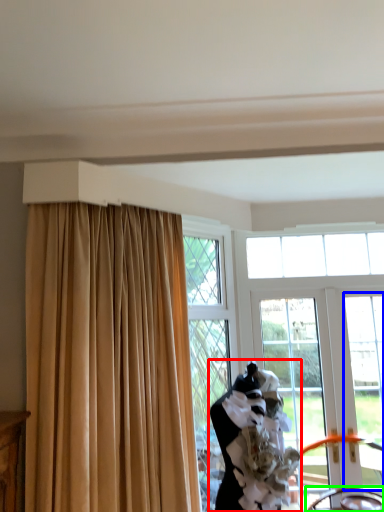
Question: Which object is positioned closest to woman (highlighted by a red box)? Select from window (highlighted by a blue box) and chair (highlighted by a green box).

Choices:
 (A) window
 (B) chair

Answer: (B)